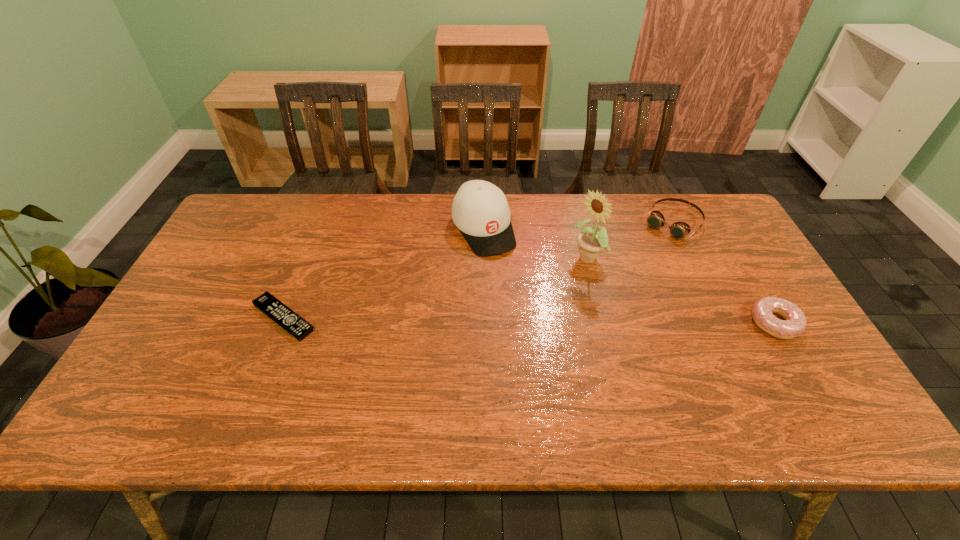
This screenshot has width=960, height=540. I want to click on free region that satisfies the following two spatial constraints: 1. on the front side of the doughnut; 2. on the right side of the goggles, so click(721, 323).

The width and height of the screenshot is (960, 540). Identify the location of free space that satisfies the following two spatial constraints: 1. on the back side of the goggles; 2. on the left side of the remote control. (321, 223).